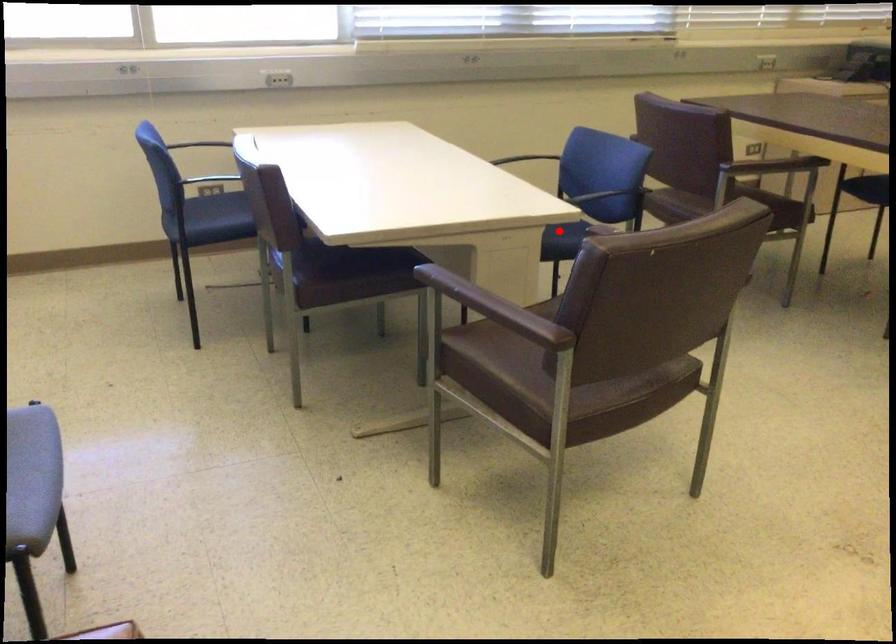
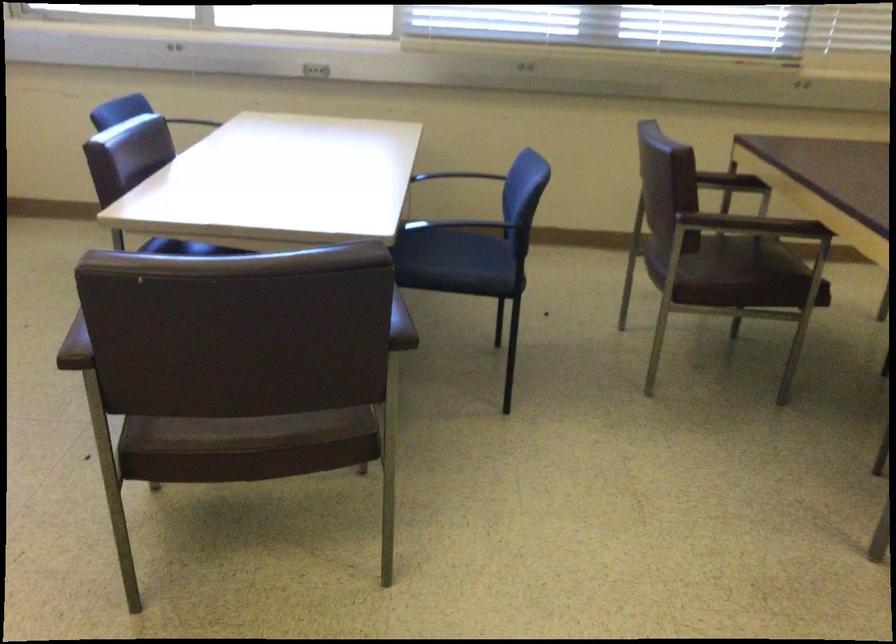
Question: I am providing you with two images of the same scene from different viewpoints. A red point is marked on the first image. At the location where the point appears in image 1, is it still visible in image 2?

Choices:
 (A) Yes
 (B) No

Answer: (A)